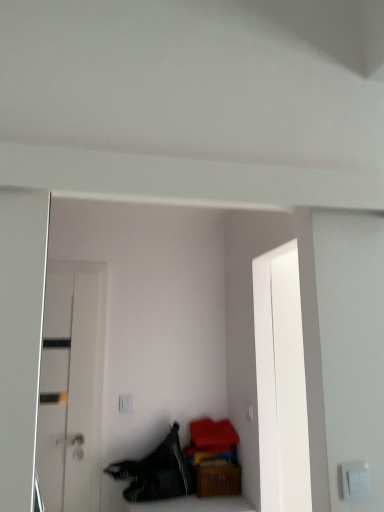
Question: From their relative heights in the image, would you say black textured fabric at lower left is taller or shorter than white plastic switch at lower right?

Choices:
 (A) tall
 (B) short

Answer: (A)

Question: Considering their positions, is black textured fabric at lower left located in front of or behind white plastic switch at lower right?

Choices:
 (A) behind
 (B) front

Answer: (A)

Question: Estimate the real-world distances between objects in this image. Which object is closer to the brown woven basket at lower right?

Choices:
 (A) white plastic switch at lower right
 (B) black textured fabric at lower left
 (C) white glossy door at left

Answer: (B)

Question: Estimate the real-world distances between objects in this image. Which object is closer to the white plastic switch at lower right?

Choices:
 (A) brown woven basket at lower right
 (B) black textured fabric at lower left
 (C) white glossy door at left

Answer: (A)